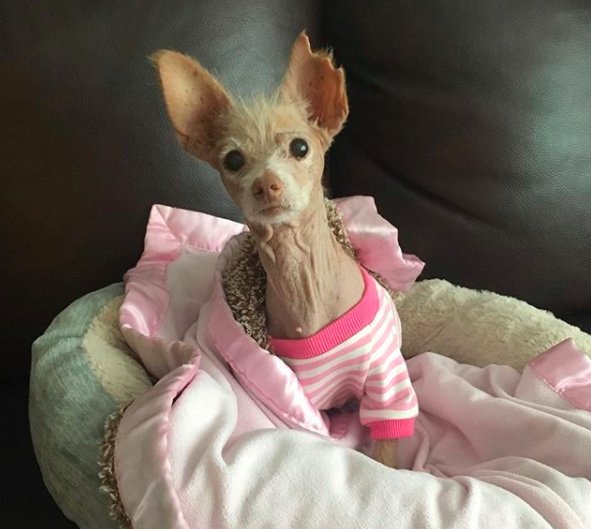
You are a GUI agent. You are given a task and a screenshot of the screen. Output one action in this format:
    pyautogui.click(x=<x>, y=<y>)
    Task: Click on the blanket
    This screenshot has height=529, width=591.
    Given the screenshot: What is the action you would take?
    pyautogui.click(x=300, y=462)